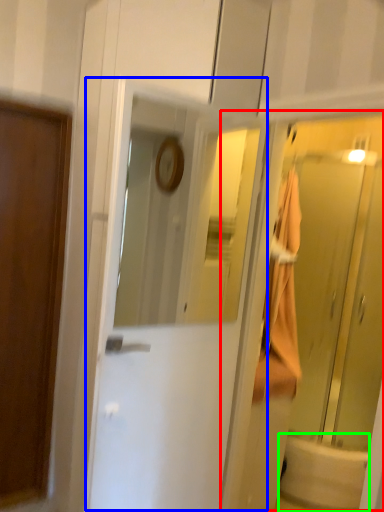
Question: Which object is the closest to the elevator (highlighted by a red box)? Choose among these: door (highlighted by a blue box) or bath (highlighted by a green box).

Choices:
 (A) door
 (B) bath

Answer: (B)